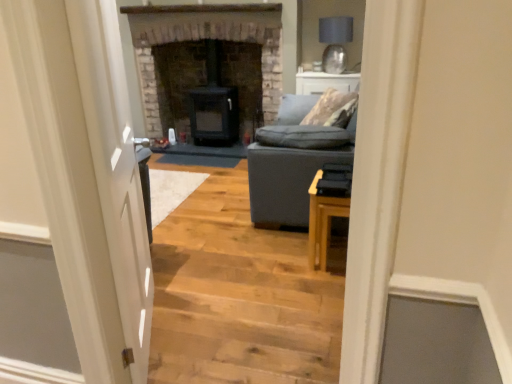
What do you see at coordinates (322, 220) in the screenshot? I see `light wood table at right` at bounding box center [322, 220].

The height and width of the screenshot is (384, 512). What do you see at coordinates (199, 40) in the screenshot?
I see `dark gray stone fireplace at center, positioned as the 2th fireplace in right-to-left order` at bounding box center [199, 40].

What is the approximate width of white glossy door at left?

white glossy door at left is 6.91 inches wide.

What do you see at coordinates (209, 86) in the screenshot? I see `black matte wood stove at center, which ranks as the 1th fireplace in right-to-left order` at bounding box center [209, 86].

Find the location of a particular element. The image size is (512, 384). light wood table at right is located at coordinates (322, 220).

Which is farther, (202, 38) or (304, 179)?

Positioned behind is point (202, 38).

Considering the positions of objects dark gray stone fireplace at center, arranged as the 1th fireplace when viewed from the left, and dark gray fabric couch at center in the image provided, who is more to the left, dark gray stone fireplace at center, arranged as the 1th fireplace when viewed from the left, or dark gray fabric couch at center?

From the viewer's perspective, dark gray stone fireplace at center, arranged as the 1th fireplace when viewed from the left, appears more on the left side.

Is dark gray stone fireplace at center, arranged as the 1th fireplace when viewed from the left, looking in the opposite direction of dark gray fabric couch at center?

No.

Does dark gray stone fireplace at center, arranged as the 1th fireplace when viewed from the left, have a lesser width compared to dark gray fabric couch at center?

Indeed, dark gray stone fireplace at center, arranged as the 1th fireplace when viewed from the left, has a lesser width compared to dark gray fabric couch at center.

Could light wood stairwell at center be considered to be inside dark gray stone fireplace at center, arranged as the 1th fireplace when viewed from the left?

That's incorrect, light wood stairwell at center is not inside dark gray stone fireplace at center, arranged as the 1th fireplace when viewed from the left.

Which object is further away from the camera taking this photo, dark gray stone fireplace at center, positioned as the 2th fireplace in right-to-left order, or light wood stairwell at center?

dark gray stone fireplace at center, positioned as the 2th fireplace in right-to-left order, is behind.

How much distance is there between dark gray stone fireplace at center, positioned as the 2th fireplace in right-to-left order, and light wood stairwell at center?

6.39 feet.

Based on the photo, between dark gray stone fireplace at center, positioned as the 2th fireplace in right-to-left order, and light wood stairwell at center, which one has smaller width?

With smaller width is dark gray stone fireplace at center, positioned as the 2th fireplace in right-to-left order.

From a real-world perspective, is white glossy door at left physically located above or below light wood stairwell at center?

white glossy door at left is above light wood stairwell at center.

Does white glossy door at left appear on the left side of light wood stairwell at center?

Yes, white glossy door at left is to the left of light wood stairwell at center.

Is point (140, 216) farther from camera compared to point (251, 346)?

Yes, it is.

Considering the relative sizes of white glossy door at left and light wood stairwell at center in the image provided, is white glossy door at left smaller than light wood stairwell at center?

Correct, white glossy door at left occupies less space than light wood stairwell at center.

Is matte gray lampshade at upper right spatially inside light wood table at right, or outside of it?

matte gray lampshade at upper right is located beyond the bounds of light wood table at right.

From the image's perspective, is matte gray lampshade at upper right positioned above or below light wood table at right?

Based on their image positions, matte gray lampshade at upper right is located above light wood table at right.

How far apart are matte gray lampshade at upper right and light wood table at right?

matte gray lampshade at upper right is 7.07 feet away from light wood table at right.

Is matte gray lampshade at upper right not close to light wood table at right?

Yes, matte gray lampshade at upper right and light wood table at right are located far from each other.

From a real-world perspective, is light wood stairwell at center positioned under black matte wood stove at center, which appears as the 2th fireplace when viewed from the left, based on gravity?

Yes, from a real-world perspective, light wood stairwell at center is beneath black matte wood stove at center, which appears as the 2th fireplace when viewed from the left.

Considering the relative positions of light wood stairwell at center and black matte wood stove at center, which ranks as the 1th fireplace in right-to-left order, in the image provided, is light wood stairwell at center behind black matte wood stove at center, which ranks as the 1th fireplace in right-to-left order,?

No.

Between light wood stairwell at center and black matte wood stove at center, which appears as the 2th fireplace when viewed from the left, which one has smaller width?

Thinner between the two is black matte wood stove at center, which appears as the 2th fireplace when viewed from the left.

Is light wood stairwell at center a part of dark gray fabric couch at center?

Actually, light wood stairwell at center is outside dark gray fabric couch at center.

Which is further, (314, 166) or (159, 319)?

The point (314, 166) is more distant.

Based on the photo, from the image's perspective, is dark gray fabric couch at center located above light wood stairwell at center?

Indeed, from the image's perspective, dark gray fabric couch at center is shown above light wood stairwell at center.

From a real-world perspective, is dark gray fabric couch at center physically above light wood stairwell at center?

Yes, from a real-world perspective, dark gray fabric couch at center is over light wood stairwell at center

Considering the relative sizes of light wood table at right and dark gray stone fireplace at center, arranged as the 1th fireplace when viewed from the left, in the image provided, is light wood table at right bigger than dark gray stone fireplace at center, arranged as the 1th fireplace when viewed from the left,?

No, light wood table at right is not bigger than dark gray stone fireplace at center, arranged as the 1th fireplace when viewed from the left.

From the picture: Is light wood table at right positioned with its back to dark gray stone fireplace at center, positioned as the 2th fireplace in right-to-left order?

No, light wood table at right's orientation is not away from dark gray stone fireplace at center, positioned as the 2th fireplace in right-to-left order.

Consider the image. How distant is light wood table at right from dark gray stone fireplace at center, positioned as the 2th fireplace in right-to-left order?

light wood table at right and dark gray stone fireplace at center, positioned as the 2th fireplace in right-to-left order, are 8.01 feet apart from each other.

Which fireplace is the 1st one when counting from the back of the dark gray fabric couch at center? Please provide its 2D coordinates.

[(199, 40)]

Locate an element on the screen. stairwell that is on the right side of dark gray stone fireplace at center, positioned as the 2th fireplace in right-to-left order is located at coordinates click(239, 294).

Considering their positions, is black matte wood stove at center, which ranks as the 1th fireplace in right-to-left order, positioned further to light wood stairwell at center than white glossy door at left?

black matte wood stove at center, which ranks as the 1th fireplace in right-to-left order, is further to light wood stairwell at center.

From the image, which object appears to be nearer to black matte wood stove at center, which appears as the 2th fireplace when viewed from the left, light wood table at right or light wood stairwell at center?

Based on the image, light wood stairwell at center appears to be nearer to black matte wood stove at center, which appears as the 2th fireplace when viewed from the left.

Which object lies nearer to the anchor point dark gray fabric couch at center, black matte wood stove at center, which appears as the 2th fireplace when viewed from the left, or light wood table at right?

light wood table at right is positioned closer to the anchor dark gray fabric couch at center.

Estimate the real-world distances between objects in this image. Which object is closer to matte gray lampshade at upper right, black matte wood stove at center, which appears as the 2th fireplace when viewed from the left, or dark gray fabric couch at center?

Based on the image, black matte wood stove at center, which appears as the 2th fireplace when viewed from the left, appears to be nearer to matte gray lampshade at upper right.

Looking at this image, based on their spatial positions, is black matte wood stove at center, which ranks as the 1th fireplace in right-to-left order, or dark gray fabric couch at center further from dark gray stone fireplace at center, positioned as the 2th fireplace in right-to-left order?

dark gray fabric couch at center is positioned further to the anchor dark gray stone fireplace at center, positioned as the 2th fireplace in right-to-left order.

Which object lies further to the anchor point white glossy door at left, dark gray fabric couch at center or dark gray stone fireplace at center, arranged as the 1th fireplace when viewed from the left?

The object further to white glossy door at left is dark gray stone fireplace at center, arranged as the 1th fireplace when viewed from the left.

Looking at the image, which one is located further to matte gray lampshade at upper right, black matte wood stove at center, which ranks as the 1th fireplace in right-to-left order, or white glossy door at left?

Based on the image, white glossy door at left appears to be further to matte gray lampshade at upper right.

Estimate the real-world distances between objects in this image. Which object is closer to light wood table at right, white glossy door at left or dark gray fabric couch at center?

Based on the image, dark gray fabric couch at center appears to be nearer to light wood table at right.

Where is `fireplace positioned between dark gray fabric couch at center and matte gray lampshade at upper right from near to far`? Image resolution: width=512 pixels, height=384 pixels. fireplace positioned between dark gray fabric couch at center and matte gray lampshade at upper right from near to far is located at coordinates (x=199, y=40).

Identify the location of table positioned between white glossy door at left and dark gray fabric couch at center from near to far. (322, 220).

Locate an element on the screen. The image size is (512, 384). table positioned between white glossy door at left and matte gray lampshade at upper right from near to far is located at coordinates (322, 220).

At what (x,y) coordinates should I click in order to perform the action: click on studio couch positioned between light wood stairwell at center and matte gray lampshade at upper right from near to far. Please return your answer as a coordinate pair (x, y). The width and height of the screenshot is (512, 384). Looking at the image, I should click on (292, 165).